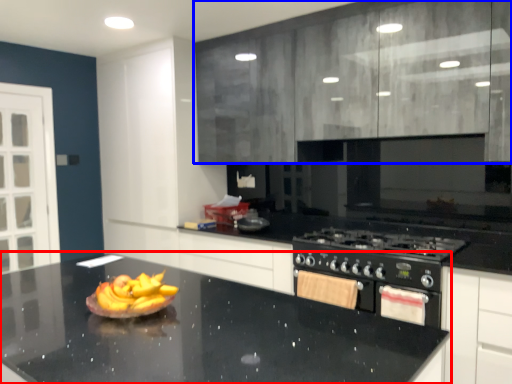
Question: Which point is closer to the camera, countertop (highlighted by a red box) or cabinetry (highlighted by a blue box)?

Choices:
 (A) countertop
 (B) cabinetry

Answer: (A)